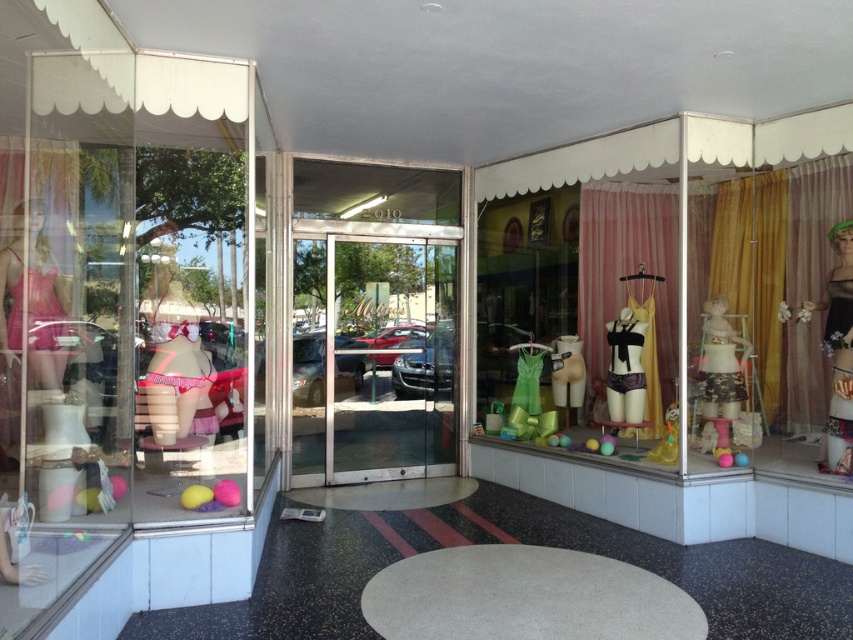
You are a customer entering the store and want to see the shiny black dress at right. However, there is a gold fabric curtain at right blocking your view. Can you see the dress clearly?

The gold fabric curtain at right is positioned over shiny black dress at right, so the curtain is blocking the view of the dress. You cannot see the dress clearly.

Looking at this image, you are a delivery person standing at the entrance of the store. You need to place a large box that is 20 feet long. Is there enough space between the gold fabric curtain at right and the entrance to fit the box?

The gold fabric curtain at right is 19.48 feet away from the camera. Since the box is 20 feet long, it would not fit in the available space.

You are standing at the entrance of the retail store and want to move towards the back of the store. If you see two points marked as point [759,250] and point [618,336], which point should you aim for to reach the back?

You should aim for point [759,250] because it is behind point [618,336], so it is closer to the back of the store.